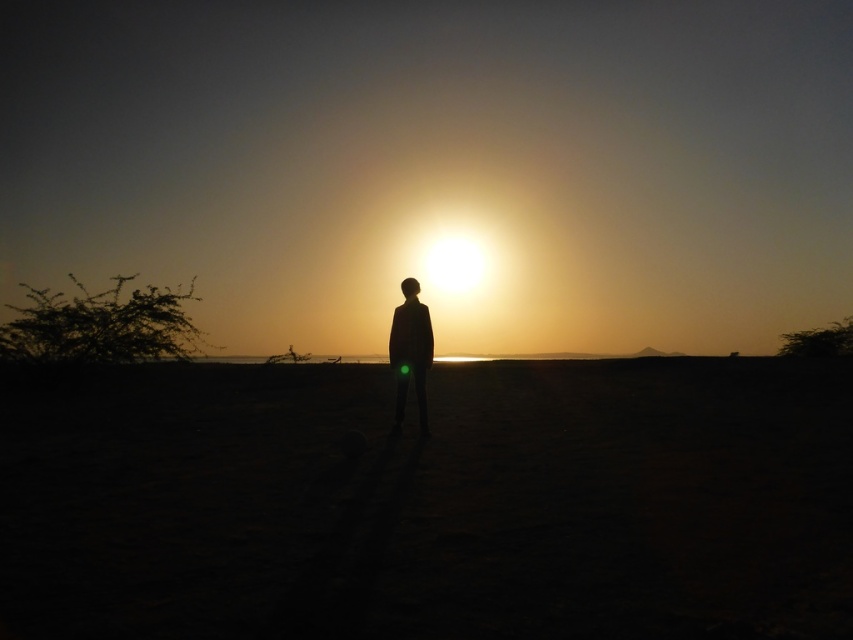
You are a photographer trying to capture the sunset scene. You notice the sandy at center and silhouette figure at center. Which object is positioned lower in the image?

The sandy at center is positioned below the silhouette figure at center, so the sandy at center is lower in the image.

You are standing in the desert scene facing the sunset. There is a sandy area at the center. If you walk straight towards the sun, will you step on the sandy at center first?

The sandy at center is located at point coordinates that are not aligned with the direction towards the sun. Since the sun is on the horizon in front of the person, walking straight towards it would not lead you to the sandy at center first. The sandy at center is positioned centrally in the image, but directionally, it might be offset depending on the exact path. However, based on the coordinates provided, it is at the center, so walking straight might pass near it. Wait, the coordinates are given as x,y.